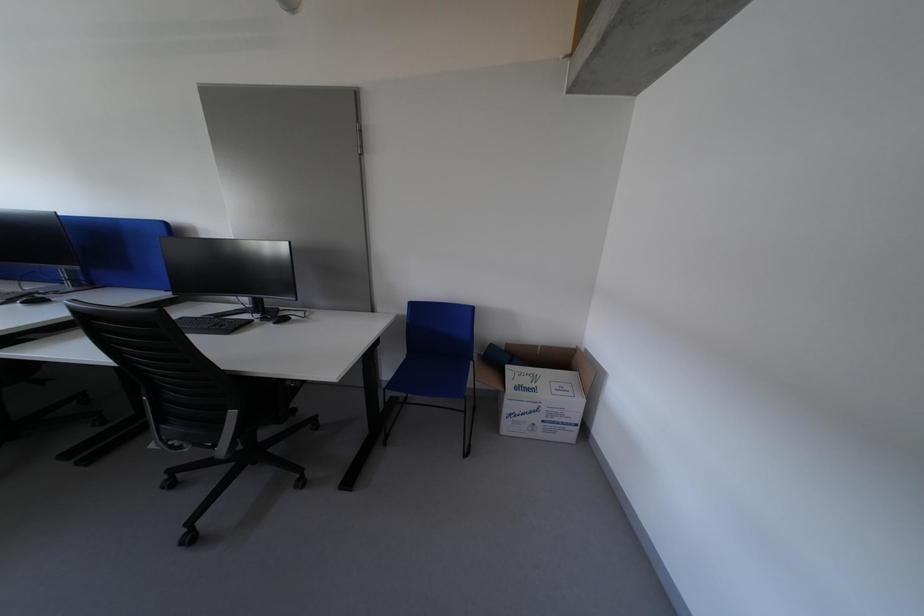
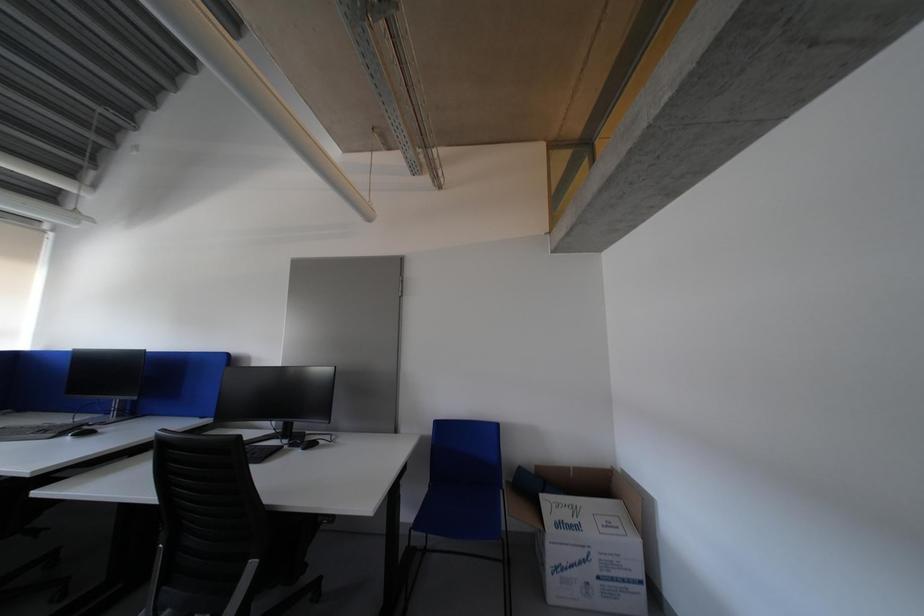
Question: The images are taken continuously from a first-person perspective. In which direction is your viewpoint rotating?

Choices:
 (A) Left
 (B) Right
 (C) Up
 (D) Down

Answer: (C)